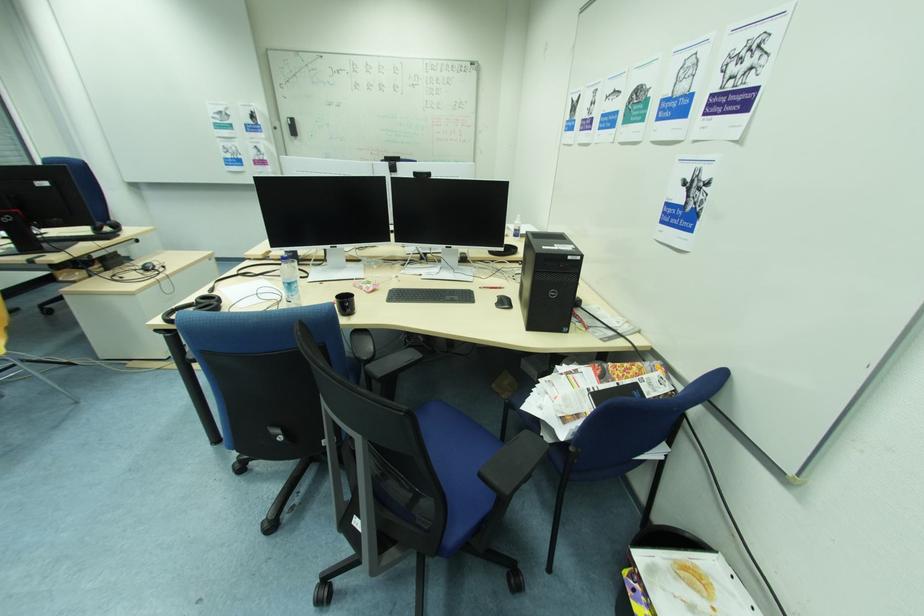
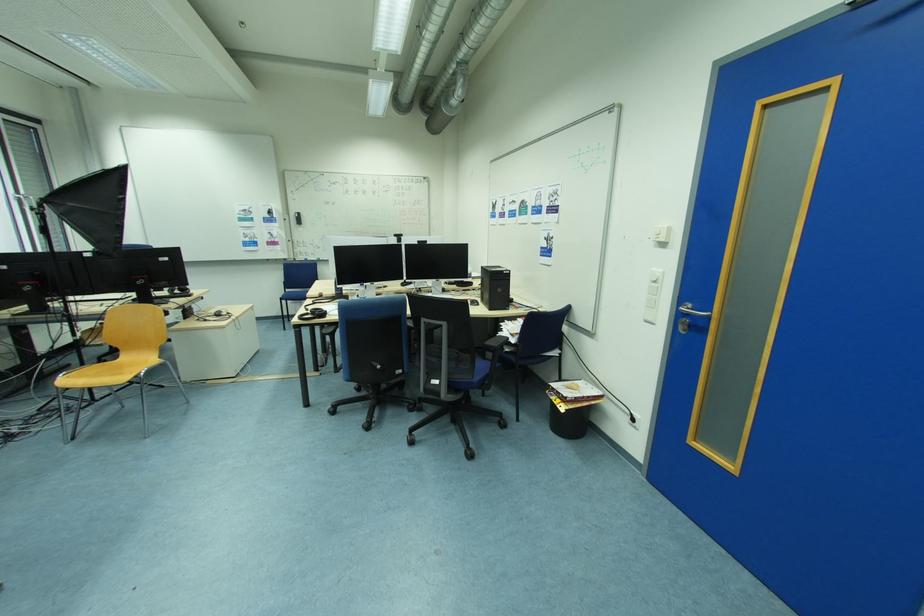
Question: I am providing you with two images of the same scene from different viewpoints. After the viewpoint changes to image2, which objects are now occluded?

Choices:
 (A) black trash can
 (B) white light switch
 (C) chair sitting surface
 (D) none of these

Answer: (D)